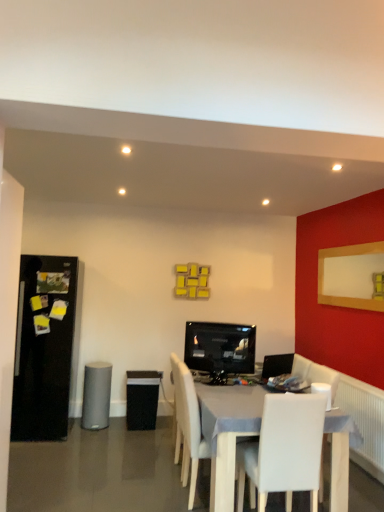
Question: From a real-world perspective, is black glossy refrigerator at left located beneath white wooden table at center?

Choices:
 (A) no
 (B) yes

Answer: (A)

Question: Is black glossy refrigerator at left at the left side of white wooden table at center?

Choices:
 (A) no
 (B) yes

Answer: (B)

Question: Does black glossy refrigerator at left have a larger size compared to white wooden table at center?

Choices:
 (A) no
 (B) yes

Answer: (A)

Question: From a real-world perspective, is black glossy refrigerator at left on top of white wooden table at center?

Choices:
 (A) no
 (B) yes

Answer: (B)

Question: Is black glossy refrigerator at left not inside white wooden table at center?

Choices:
 (A) yes
 (B) no

Answer: (A)

Question: Does black glossy refrigerator at left have a lesser height compared to white wooden table at center?

Choices:
 (A) yes
 (B) no

Answer: (B)

Question: From a real-world perspective, is white leather chair at center, the 2th chair when ordered from back to front, physically above white plastic speaker at lower right, the first speaker in the right-to-left sequence?

Choices:
 (A) yes
 (B) no

Answer: (B)

Question: Considering the relative positions of white leather chair at center, acting as the first chair starting from the front, and white plastic speaker at lower right, placed as the 3th speaker when sorted from back to front, in the image provided, is white leather chair at center, acting as the first chair starting from the front, in front of white plastic speaker at lower right, placed as the 3th speaker when sorted from back to front,?

Choices:
 (A) yes
 (B) no

Answer: (A)

Question: Is white leather chair at center, the 2th chair when ordered from back to front, further to the viewer compared to white plastic speaker at lower right, placed as the 1th speaker when sorted from front to back?

Choices:
 (A) no
 (B) yes

Answer: (A)

Question: From the image's perspective, is white leather chair at center, the 2th chair when ordered from back to front, under white plastic speaker at lower right, the third speaker when ordered from left to right?

Choices:
 (A) no
 (B) yes

Answer: (B)

Question: Is white leather chair at center, acting as the first chair starting from the front, taller than white plastic speaker at lower right, placed as the 3th speaker when sorted from back to front?

Choices:
 (A) no
 (B) yes

Answer: (B)

Question: Is white plastic speaker at lower right, placed as the 1th speaker when sorted from front to back, at the back of white leather chair at center, the 2th chair when ordered from back to front?

Choices:
 (A) no
 (B) yes

Answer: (A)

Question: From the image's perspective, would you say black glossy tv at center is shown under white leather chair at center, the 2th chair when ordered from back to front?

Choices:
 (A) yes
 (B) no

Answer: (B)